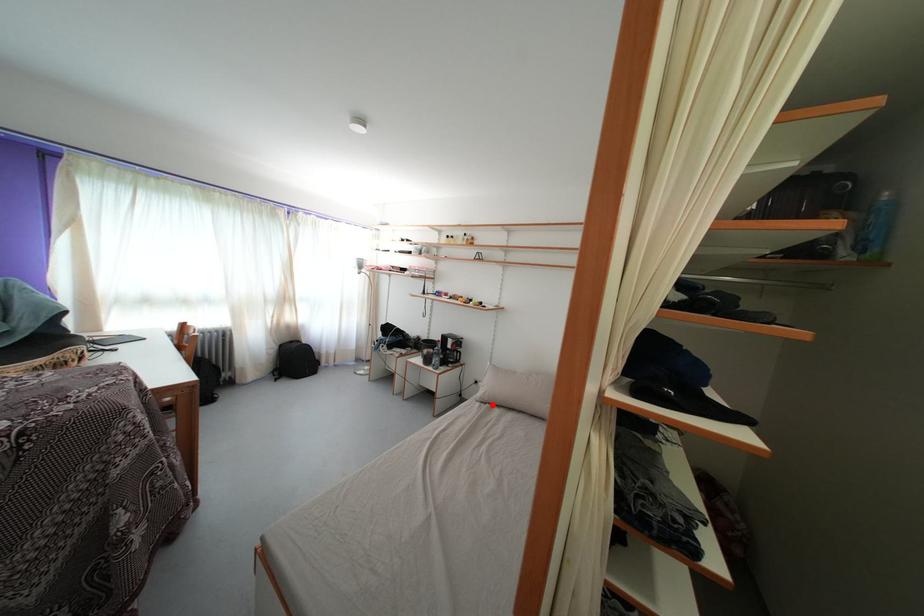
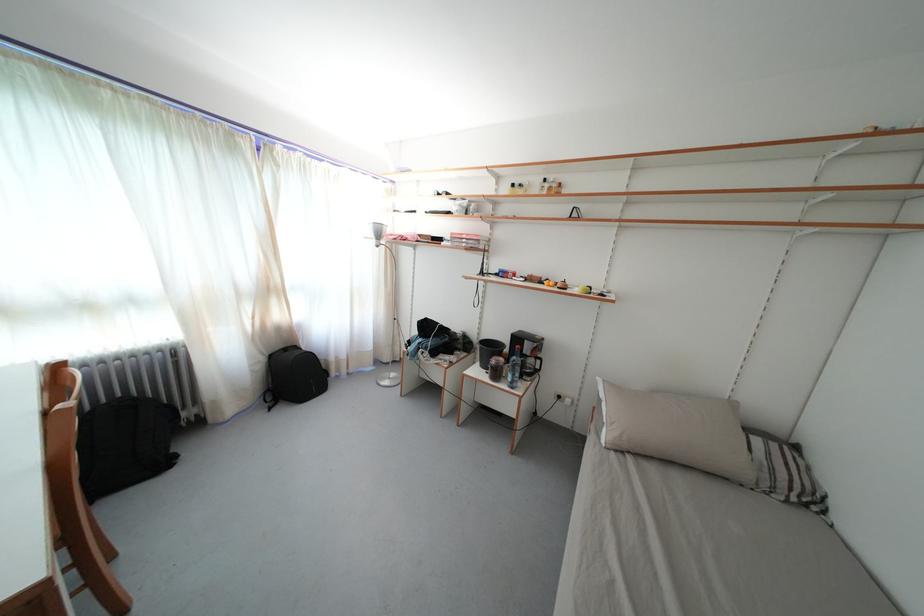
Question: I am providing you with two images of the same scene from different viewpoints. A red point is shown in image1. For the corresponding object point in image2, is it positioned nearer or farther from the camera?

Choices:
 (A) Nearer
 (B) Farther

Answer: (B)